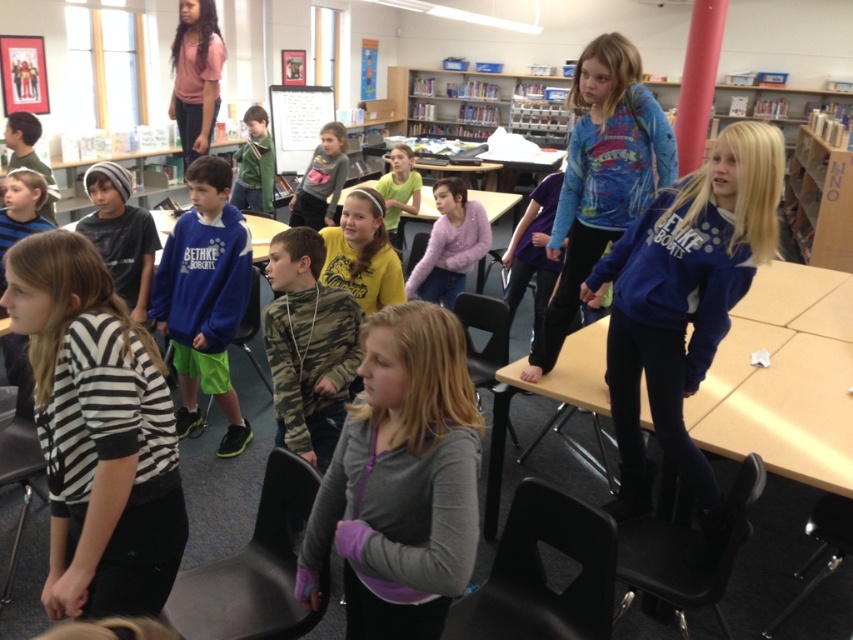
What is the object located at the coordinates point (308, 346) in the classroom scene?

The object located at point (308, 346) is the camo fabric shirt at center.